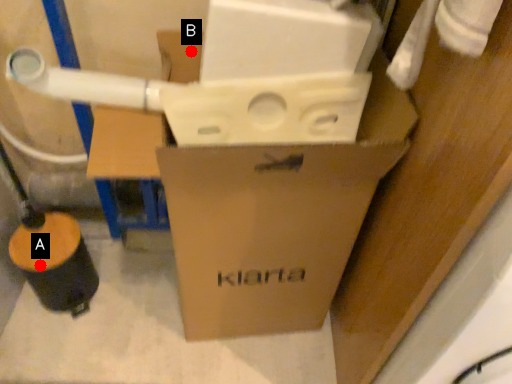
Question: Two points are circled on the image, labeled by A and B beside each circle. Which point is further to the camera?

Choices:
 (A) A is further
 (B) B is further

Answer: (A)